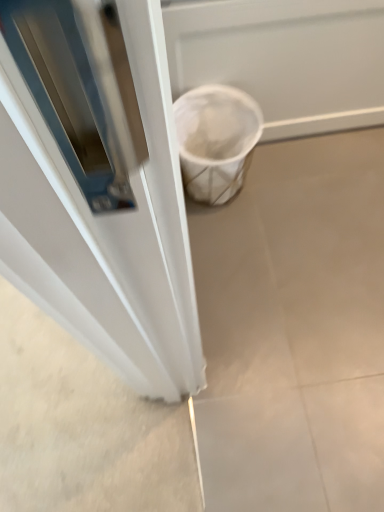
Question: Does white matte trash can at lower right lie behind white mesh screen door at lower right?

Choices:
 (A) no
 (B) yes

Answer: (B)

Question: Considering the relative positions of white matte trash can at lower right and white mesh screen door at lower right in the image provided, is white matte trash can at lower right to the right of white mesh screen door at lower right from the viewer's perspective?

Choices:
 (A) yes
 (B) no

Answer: (B)

Question: Could you tell me if white matte trash can at lower right is facing white mesh screen door at lower right?

Choices:
 (A) no
 (B) yes

Answer: (A)

Question: Considering the relative sizes of white matte trash can at lower right and white mesh screen door at lower right in the image provided, is white matte trash can at lower right wider than white mesh screen door at lower right?

Choices:
 (A) yes
 (B) no

Answer: (A)

Question: Is white matte trash can at lower right placed right next to white mesh screen door at lower right?

Choices:
 (A) no
 (B) yes

Answer: (A)

Question: Considering the relative positions of white matte trash can at lower right and white mesh screen door at lower right in the image provided, is white matte trash can at lower right to the left of white mesh screen door at lower right from the viewer's perspective?

Choices:
 (A) no
 (B) yes

Answer: (B)

Question: From a real-world perspective, is white mesh screen door at lower right on white matte trash can at lower right?

Choices:
 (A) no
 (B) yes

Answer: (B)

Question: Is white mesh screen door at lower right positioned with its back to white matte trash can at lower right?

Choices:
 (A) no
 (B) yes

Answer: (A)

Question: Is white mesh screen door at lower right surrounding white matte trash can at lower right?

Choices:
 (A) no
 (B) yes

Answer: (A)

Question: Is white mesh screen door at lower right shorter than white matte trash can at lower right?

Choices:
 (A) yes
 (B) no

Answer: (B)

Question: Considering the relative positions of white mesh screen door at lower right and white matte trash can at lower right in the image provided, is white mesh screen door at lower right to the left of white matte trash can at lower right from the viewer's perspective?

Choices:
 (A) no
 (B) yes

Answer: (A)

Question: Is white mesh screen door at lower right not close to white matte trash can at lower right?

Choices:
 (A) yes
 (B) no

Answer: (B)

Question: Choose the correct answer: Is white matte trash can at lower right inside white mesh screen door at lower right or outside it?

Choices:
 (A) inside
 (B) outside

Answer: (B)